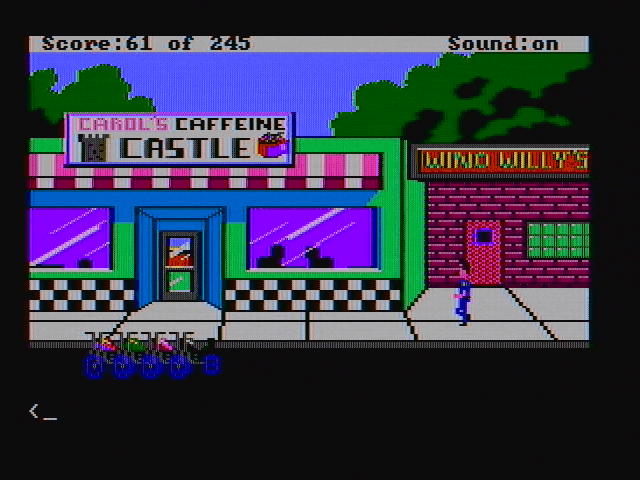
Locate an element on the screen. This screenshot has width=640, height=480. green windows is located at coordinates (556, 246).